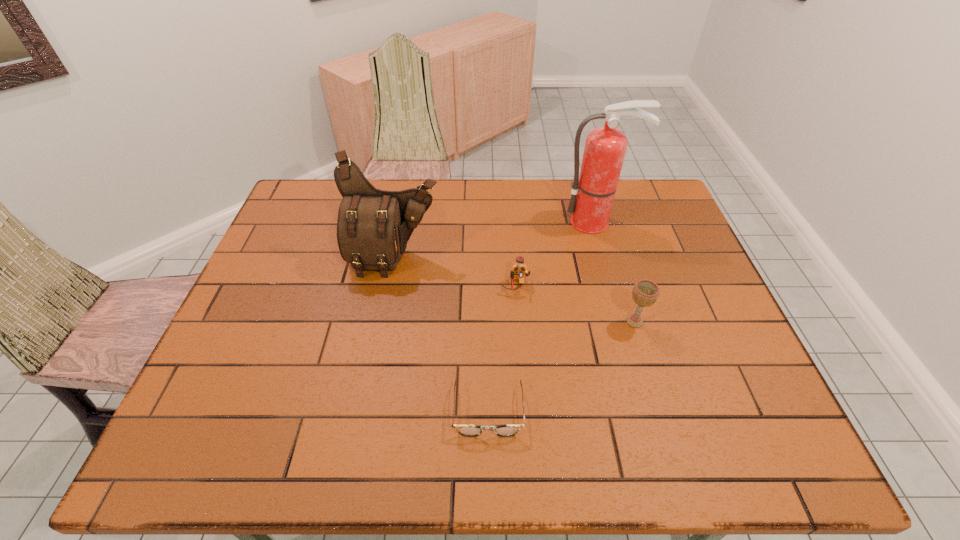
Find the location of a particular element. The width and height of the screenshot is (960, 540). free space at the right edge is located at coordinates (757, 403).

This screenshot has width=960, height=540. In the image, there is a desktop. Identify the location of blank space at the far left corner. (299, 187).

The image size is (960, 540). In order to click on vacant space at the far right corner in this screenshot , I will do `click(621, 194)`.

Image resolution: width=960 pixels, height=540 pixels. I want to click on free space at the near right corner of the desktop, so point(764,428).

Where is `vacant area between the Lego and the farthest object`? vacant area between the Lego and the farthest object is located at coordinates (555, 254).

Where is `unoccupied area between the shortest object and the fourth farthest object`? unoccupied area between the shortest object and the fourth farthest object is located at coordinates (561, 366).

I want to click on free area in between the nearest object and the Lego, so click(x=502, y=348).

You are a GUI agent. You are given a task and a screenshot of the screen. Output one action in this format:
    pyautogui.click(x=<x>, y=<y>)
    Task: Click on the vacant area between the second shortest object and the spectacles
    Image resolution: width=960 pixels, height=540 pixels.
    Given the screenshot: What is the action you would take?
    pyautogui.click(x=502, y=348)

Locate an element on the screen. The width and height of the screenshot is (960, 540). free space between the fourth tallest object and the fourth farthest object is located at coordinates (575, 304).

The image size is (960, 540). In order to click on free point between the Lego and the shoulder bag in this screenshot , I will do `click(455, 272)`.